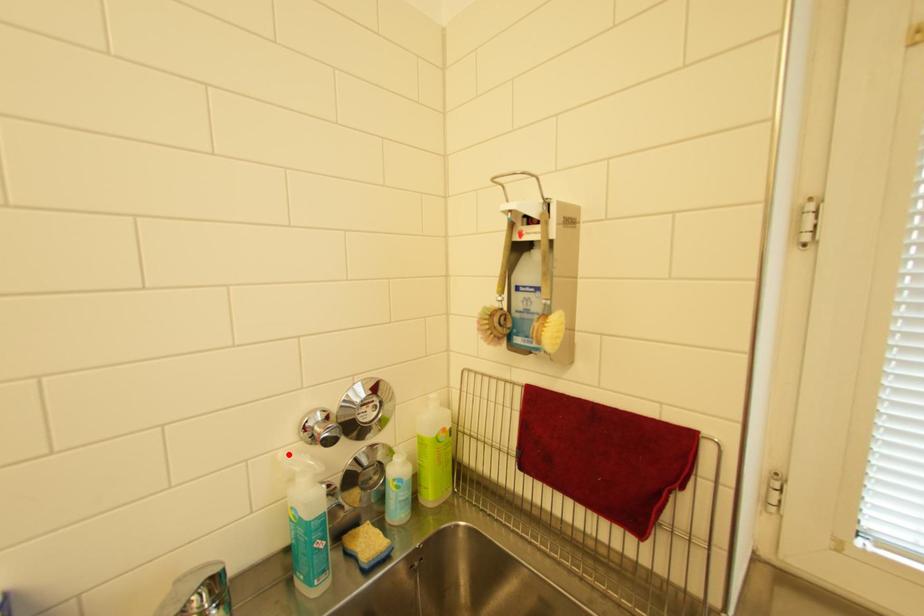
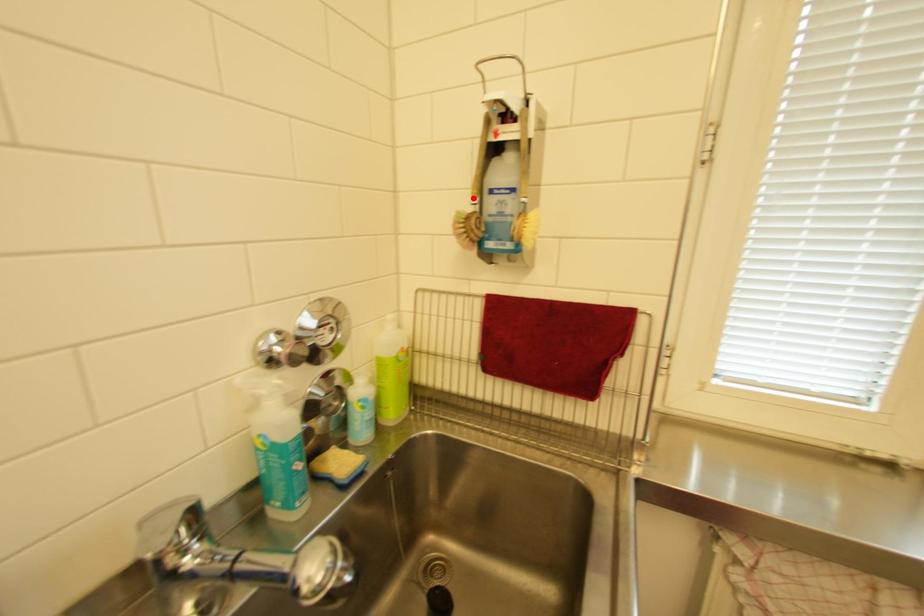
I am providing you with two images of the same scene from different viewpoints. A red point is marked on the first image and another point is marked on the second image. Are the points marked in image1 and image2 representing the same 3D position?

No